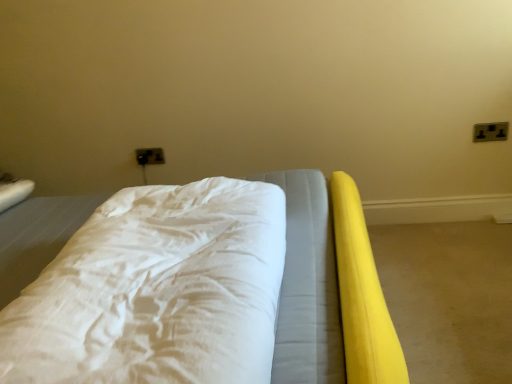
What is the approximate height of yellow rubber mat at right?

yellow rubber mat at right is 2.80 inches tall.

Where is `white soft bed at center`? The width and height of the screenshot is (512, 384). white soft bed at center is located at coordinates (330, 289).

Considering the points (476, 127) and (470, 319), which point is behind, point (476, 127) or point (470, 319)?

Point (476, 127)

Could you tell me if black plastic electric outlet at upper right, acting as the 2th electric outlet starting from the bottom, is facing yellow rubber mat at right?

No, black plastic electric outlet at upper right, acting as the 2th electric outlet starting from the bottom, does not turn towards yellow rubber mat at right.

In terms of height, does black plastic electric outlet at upper right, acting as the 2th electric outlet starting from the bottom, look taller or shorter compared to yellow rubber mat at right?

In the image, black plastic electric outlet at upper right, acting as the 2th electric outlet starting from the bottom, appears to be taller than yellow rubber mat at right.

Is black plastic electric outlet at upper right, acting as the 2th electric outlet starting from the bottom, in front of yellow rubber mat at right?

No, it is not.

Is black plastic electric outlet at upper right, the second electric outlet when ordered from left to right, turned away from white soft bed at center?

No, black plastic electric outlet at upper right, the second electric outlet when ordered from left to right,'s orientation is not away from white soft bed at center.

Is black plastic electric outlet at upper right, which is counted as the first electric outlet, starting from the right, directly adjacent to white soft bed at center?

No, black plastic electric outlet at upper right, which is counted as the first electric outlet, starting from the right, is not with white soft bed at center.

Considering the relative sizes of black plastic electric outlet at upper right, acting as the 2th electric outlet starting from the bottom, and white soft bed at center in the image provided, is black plastic electric outlet at upper right, acting as the 2th electric outlet starting from the bottom, bigger than white soft bed at center?

Actually, black plastic electric outlet at upper right, acting as the 2th electric outlet starting from the bottom, might be smaller than white soft bed at center.

What are the coordinates of `bed positioned vertically above the black plastic electric outlet at upper right, placed as the first electric outlet when sorted from top to bottom (from a real-world perspective)` in the screenshot? It's located at (330, 289).

Is matte plastic outlet at upper center, positioned as the 1th electric outlet in back-to-front order, not inside yellow rubber mat at right?

Absolutely, matte plastic outlet at upper center, positioned as the 1th electric outlet in back-to-front order, is external to yellow rubber mat at right.

From the image's perspective, would you say matte plastic outlet at upper center, arranged as the second electric outlet when viewed from the front, is positioned over yellow rubber mat at right?

Yes, from the image's perspective, matte plastic outlet at upper center, arranged as the second electric outlet when viewed from the front, is on top of yellow rubber mat at right.

Considering the positions of point (145, 160) and point (492, 282), is point (145, 160) closer or farther from the camera than point (492, 282)?

Point (145, 160) appears to be farther away from the viewer than point (492, 282).

Is matte plastic outlet at upper center, which ranks as the second electric outlet in top-to-bottom order, further to the viewer compared to yellow rubber mat at right?

Yes, the depth of matte plastic outlet at upper center, which ranks as the second electric outlet in top-to-bottom order, is greater than that of yellow rubber mat at right.

Who is shorter, white soft bed at center or matte plastic outlet at upper center, arranged as the second electric outlet when viewed from the front?

With less height is matte plastic outlet at upper center, arranged as the second electric outlet when viewed from the front.

Does white soft bed at center turn towards matte plastic outlet at upper center, positioned as the 1th electric outlet in back-to-front order?

No, white soft bed at center does not turn towards matte plastic outlet at upper center, positioned as the 1th electric outlet in back-to-front order.

Considering the positions of objects white soft bed at center and matte plastic outlet at upper center, positioned as the 1th electric outlet in back-to-front order, in the image provided, who is in front, white soft bed at center or matte plastic outlet at upper center, positioned as the 1th electric outlet in back-to-front order,?

white soft bed at center is in front.

From the image's perspective, which object appears higher, matte plastic outlet at upper center, which ranks as the second electric outlet in top-to-bottom order, or black plastic electric outlet at upper right, the first electric outlet positioned from the front?

black plastic electric outlet at upper right, the first electric outlet positioned from the front, appears higher in the image.

Considering the relative positions of matte plastic outlet at upper center, which is the 1th electric outlet in left-to-right order, and black plastic electric outlet at upper right, the first electric outlet positioned from the front, in the image provided, is matte plastic outlet at upper center, which is the 1th electric outlet in left-to-right order, to the right of black plastic electric outlet at upper right, the first electric outlet positioned from the front, from the viewer's perspective?

Incorrect, matte plastic outlet at upper center, which is the 1th electric outlet in left-to-right order, is not on the right side of black plastic electric outlet at upper right, the first electric outlet positioned from the front.

In the scene shown: Is matte plastic outlet at upper center, which appears as the second electric outlet when viewed from the right, not close to black plastic electric outlet at upper right, which is counted as the first electric outlet, starting from the right?

matte plastic outlet at upper center, which appears as the second electric outlet when viewed from the right, is far away from black plastic electric outlet at upper right, which is counted as the first electric outlet, starting from the right.

Based on the photo, in terms of height, does matte plastic outlet at upper center, positioned as the 1th electric outlet in back-to-front order, look taller or shorter compared to black plastic electric outlet at upper right, placed as the first electric outlet when sorted from top to bottom?

In the image, matte plastic outlet at upper center, positioned as the 1th electric outlet in back-to-front order, appears to be shorter than black plastic electric outlet at upper right, placed as the first electric outlet when sorted from top to bottom.

Is yellow rubber mat at right looking in the opposite direction of matte plastic outlet at upper center, which appears as the second electric outlet when viewed from the right?

No, yellow rubber mat at right's orientation is not away from matte plastic outlet at upper center, which appears as the second electric outlet when viewed from the right.

Considering the positions of point (455, 244) and point (144, 149), is point (455, 244) closer or farther from the camera than point (144, 149)?

Clearly, point (455, 244) is closer to the camera than point (144, 149).

From the image's perspective, is yellow rubber mat at right located beneath matte plastic outlet at upper center, positioned as the 1th electric outlet in back-to-front order?

Indeed, from the image's perspective, yellow rubber mat at right is shown beneath matte plastic outlet at upper center, positioned as the 1th electric outlet in back-to-front order.

Can you see yellow rubber mat at right touching matte plastic outlet at upper center, the first electric outlet in the bottom-to-top sequence?

No, yellow rubber mat at right is not making contact with matte plastic outlet at upper center, the first electric outlet in the bottom-to-top sequence.

Is white soft bed at center taller than black plastic electric outlet at upper right, the second electric outlet when ordered from left to right?

Yes.

Considering the relative positions of white soft bed at center and black plastic electric outlet at upper right, placed as the first electric outlet when sorted from top to bottom, in the image provided, is white soft bed at center to the right of black plastic electric outlet at upper right, placed as the first electric outlet when sorted from top to bottom, from the viewer's perspective?

No, white soft bed at center is not to the right of black plastic electric outlet at upper right, placed as the first electric outlet when sorted from top to bottom.

Is white soft bed at center bigger than black plastic electric outlet at upper right, the second electric outlet when ordered from left to right?

Yes.

Locate an element on the screen. electric outlet that is the 1st object above the yellow rubber mat at right (from a real-world perspective) is located at coordinates (490, 132).

Locate an element on the screen. The image size is (512, 384). electric outlet that is the 2nd object directly below the white soft bed at center (from a real-world perspective) is located at coordinates (490, 132).

Based on the photo, considering their positions, is black plastic electric outlet at upper right, the second electric outlet when ordered from left to right, positioned further to white soft bed at center than yellow rubber mat at right?

black plastic electric outlet at upper right, the second electric outlet when ordered from left to right, is further to white soft bed at center.

Which object lies nearer to the anchor point yellow rubber mat at right, black plastic electric outlet at upper right, the first electric outlet positioned from the front, or white soft bed at center?

Among the two, white soft bed at center is located nearer to yellow rubber mat at right.

Based on their spatial positions, is white soft bed at center or black plastic electric outlet at upper right, which is counted as the first electric outlet, starting from the right, closer to matte plastic outlet at upper center, arranged as the second electric outlet when viewed from the front?

Among the two, white soft bed at center is located nearer to matte plastic outlet at upper center, arranged as the second electric outlet when viewed from the front.

Considering their positions, is yellow rubber mat at right positioned further to black plastic electric outlet at upper right, which is counted as the first electric outlet, starting from the right, than matte plastic outlet at upper center, which is the 1th electric outlet in left-to-right order?

matte plastic outlet at upper center, which is the 1th electric outlet in left-to-right order, is positioned further to the anchor black plastic electric outlet at upper right, which is counted as the first electric outlet, starting from the right.

Considering their positions, is yellow rubber mat at right positioned closer to matte plastic outlet at upper center, positioned as the 1th electric outlet in back-to-front order, than white soft bed at center?

Among the two, white soft bed at center is located nearer to matte plastic outlet at upper center, positioned as the 1th electric outlet in back-to-front order.

From the image, which object appears to be nearer to black plastic electric outlet at upper right, the second electric outlet positioned from the back, matte plastic outlet at upper center, which is the 1th electric outlet in left-to-right order, or yellow rubber mat at right?

yellow rubber mat at right.

From the picture: Estimate the real-world distances between objects in this image. Which object is further from white soft bed at center, yellow rubber mat at right or matte plastic outlet at upper center, which appears as the second electric outlet when viewed from the right?

matte plastic outlet at upper center, which appears as the second electric outlet when viewed from the right, is further to white soft bed at center.

From the image, which object appears to be farther from matte plastic outlet at upper center, which is the 1th electric outlet in left-to-right order, black plastic electric outlet at upper right, placed as the first electric outlet when sorted from top to bottom, or yellow rubber mat at right?

black plastic electric outlet at upper right, placed as the first electric outlet when sorted from top to bottom, is further to matte plastic outlet at upper center, which is the 1th electric outlet in left-to-right order.

Locate an element on the screen. The image size is (512, 384). concrete between white soft bed at center and black plastic electric outlet at upper right, the second electric outlet when ordered from left to right, in the front-back direction is located at coordinates (449, 298).

Locate an element on the screen. The height and width of the screenshot is (384, 512). concrete positioned between white soft bed at center and matte plastic outlet at upper center, arranged as the second electric outlet when viewed from the front, from near to far is located at coordinates (449, 298).

Find the location of a particular element. electric outlet located between white soft bed at center and matte plastic outlet at upper center, the first electric outlet in the bottom-to-top sequence, in the depth direction is located at coordinates (490, 132).

Find the location of a particular element. The image size is (512, 384). concrete located between matte plastic outlet at upper center, arranged as the second electric outlet when viewed from the front, and black plastic electric outlet at upper right, the second electric outlet positioned from the back, in the left-right direction is located at coordinates (449, 298).